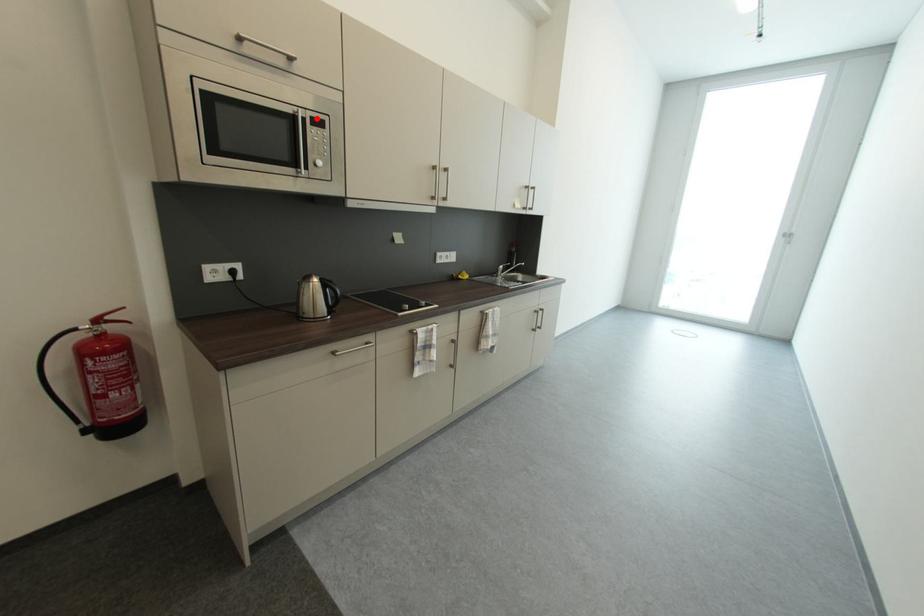
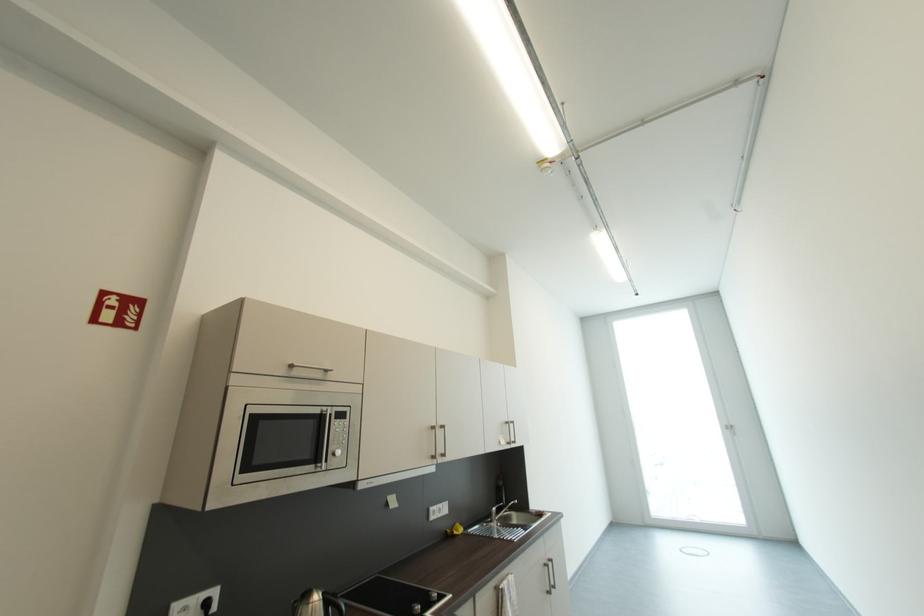
In the second image, find the point that corresponds to the highlighted location in the first image.

(342, 413)